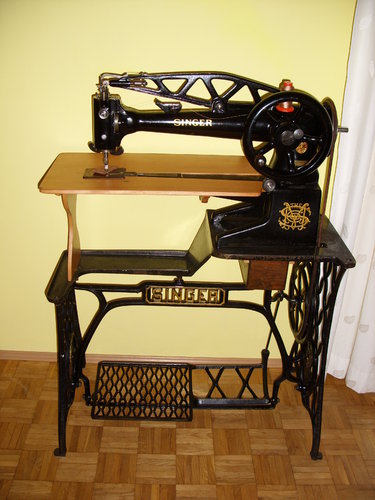
What are the coordinates of `wood table` in the screenshot? It's located at [158, 188].